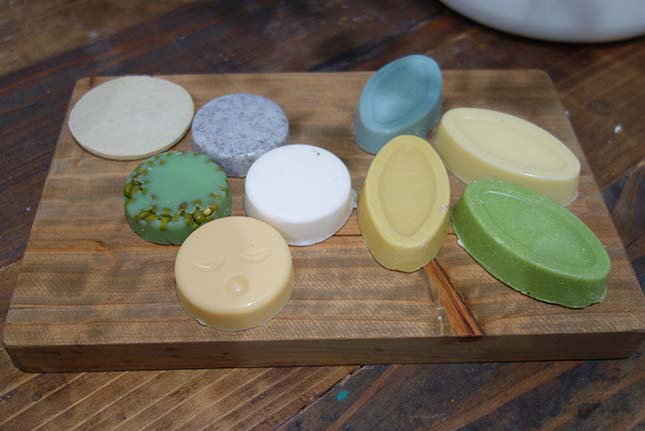
Where is `blue soap`? The width and height of the screenshot is (645, 431). blue soap is located at coordinates (406, 114), (266, 130).